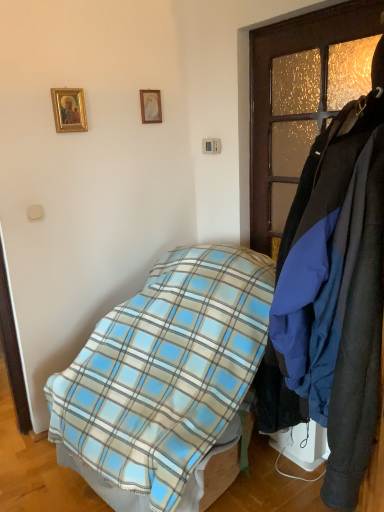
Question: Considering the relative positions of wooden picture frame at upper center, the first picture frame positioned from the back, and dark wood coat rack at right in the image provided, is wooden picture frame at upper center, the first picture frame positioned from the back, to the right of dark wood coat rack at right from the viewer's perspective?

Choices:
 (A) yes
 (B) no

Answer: (B)

Question: From the image's perspective, is wooden picture frame at upper center, the 2th picture frame viewed from the left, on top of dark wood coat rack at right?

Choices:
 (A) yes
 (B) no

Answer: (A)

Question: From the image's perspective, is wooden picture frame at upper center, which appears as the 1th picture frame when viewed from the right, located beneath dark wood coat rack at right?

Choices:
 (A) no
 (B) yes

Answer: (A)

Question: Is dark wood coat rack at right inside wooden picture frame at upper center, which appears as the 1th picture frame when viewed from the right?

Choices:
 (A) no
 (B) yes

Answer: (A)

Question: Considering the relative positions of wooden picture frame at upper center, which appears as the 1th picture frame when viewed from the right, and dark wood coat rack at right in the image provided, is wooden picture frame at upper center, which appears as the 1th picture frame when viewed from the right, to the left of dark wood coat rack at right from the viewer's perspective?

Choices:
 (A) no
 (B) yes

Answer: (B)

Question: Could you tell me if wooden picture frame at upper center, the first picture frame positioned from the back, is facing dark wood coat rack at right?

Choices:
 (A) no
 (B) yes

Answer: (B)

Question: Is blue plaid blanket at center taller than dark wood coat rack at right?

Choices:
 (A) no
 (B) yes

Answer: (A)

Question: Is dark wood coat rack at right at the back of blue plaid blanket at center?

Choices:
 (A) no
 (B) yes

Answer: (A)

Question: Considering the relative positions of blue plaid blanket at center and dark wood coat rack at right in the image provided, is blue plaid blanket at center in front of dark wood coat rack at right?

Choices:
 (A) no
 (B) yes

Answer: (A)

Question: Could you tell me if blue plaid blanket at center is turned towards dark wood coat rack at right?

Choices:
 (A) yes
 (B) no

Answer: (B)

Question: Can you confirm if blue plaid blanket at center is positioned to the right of dark wood coat rack at right?

Choices:
 (A) yes
 (B) no

Answer: (B)

Question: From the image's perspective, is blue plaid blanket at center over dark wood coat rack at right?

Choices:
 (A) no
 (B) yes

Answer: (A)

Question: Does dark wood coat rack at right have a greater width compared to gold-framed picture at upper left, marked as the 2th picture frame in a right-to-left arrangement?

Choices:
 (A) no
 (B) yes

Answer: (B)